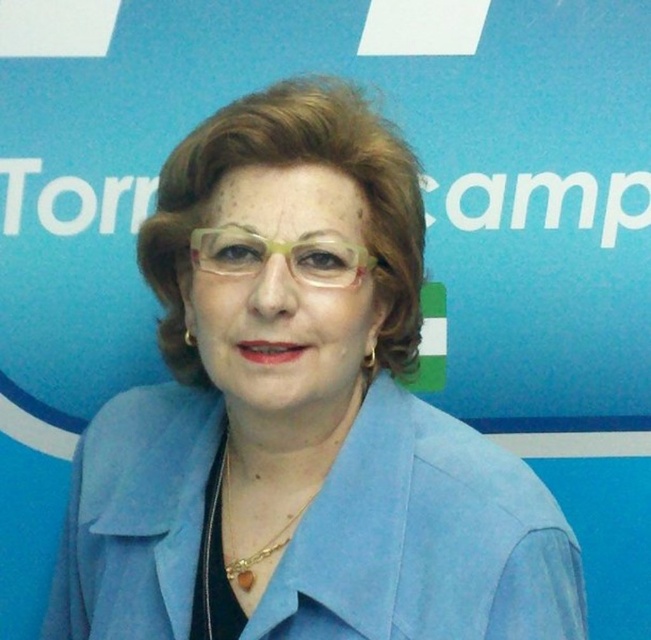
You are a fashion stylist preparing for a photoshoot. You need to adjust the position of the blue suede jacket at center and the clear plastic glasses at center so that the glasses are now to the right of the jacket. How should you move the items?

To position the clear plastic glasses at center to the right of the blue suede jacket at center, you should move the clear plastic glasses at center to the right side of the blue suede jacket at center.

You are a fashion stylist trying to decide whether the blue suede jacket at center can be folded and placed inside the clear plastic glasses at center. Based on their sizes, is this feasible?

The blue suede jacket at center might be wider than clear plastic glasses at center, so it is unlikely that the jacket can be folded and placed inside the glasses as the jacket is probably too large.